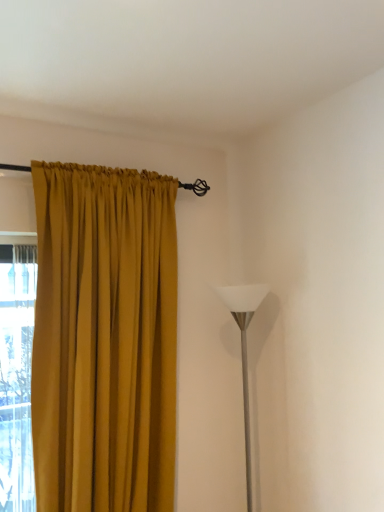
Question: Considering the positions of mustard fabric curtain at left and white glossy floor lamp at right in the image, is mustard fabric curtain at left taller or shorter than white glossy floor lamp at right?

Choices:
 (A) tall
 (B) short

Answer: (A)

Question: From the image's perspective, is mustard fabric curtain at left located above or below white glossy floor lamp at right?

Choices:
 (A) below
 (B) above

Answer: (B)

Question: Would you say mustard fabric curtain at left is to the left or to the right of white glossy floor lamp at right in the picture?

Choices:
 (A) left
 (B) right

Answer: (A)

Question: Is white glossy floor lamp at right spatially inside mustard fabric curtain at left, or outside of it?

Choices:
 (A) outside
 (B) inside

Answer: (A)

Question: From the image's perspective, is white glossy floor lamp at right positioned above or below mustard fabric curtain at left?

Choices:
 (A) above
 (B) below

Answer: (B)

Question: Considering the positions of white glossy floor lamp at right and mustard fabric curtain at left in the image, is white glossy floor lamp at right bigger or smaller than mustard fabric curtain at left?

Choices:
 (A) big
 (B) small

Answer: (B)

Question: From a real-world perspective, is white glossy floor lamp at right positioned above or below mustard fabric curtain at left?

Choices:
 (A) above
 (B) below

Answer: (B)